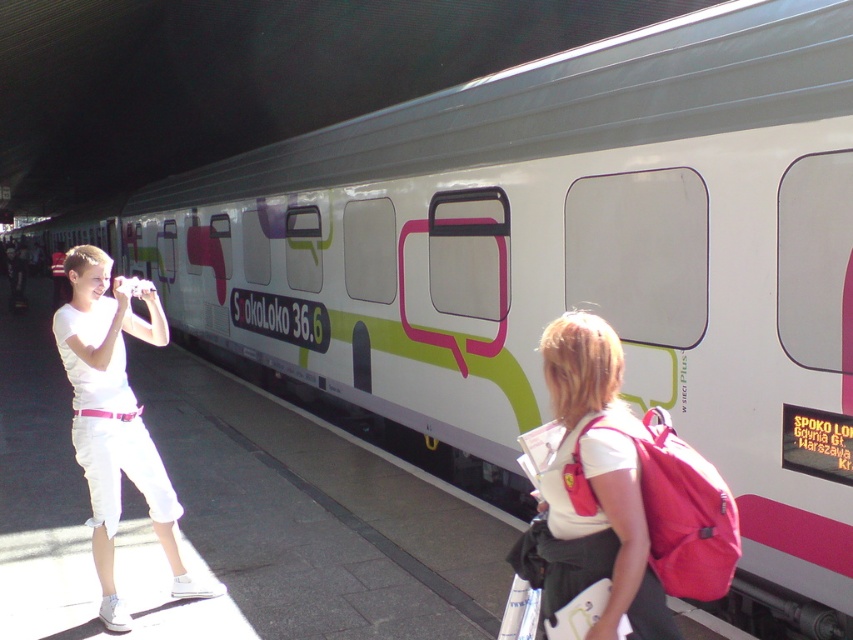
Which is above, matte pink backpack at center or white cotton shirt at left?

matte pink backpack at center

Can you confirm if matte pink backpack at center is bigger than white cotton shirt at left?

No.

Does point (608, 573) come closer to viewer compared to point (99, 461)?

Yes.

The image size is (853, 640). Find the location of `matte pink backpack at center`. matte pink backpack at center is located at coordinates (592, 488).